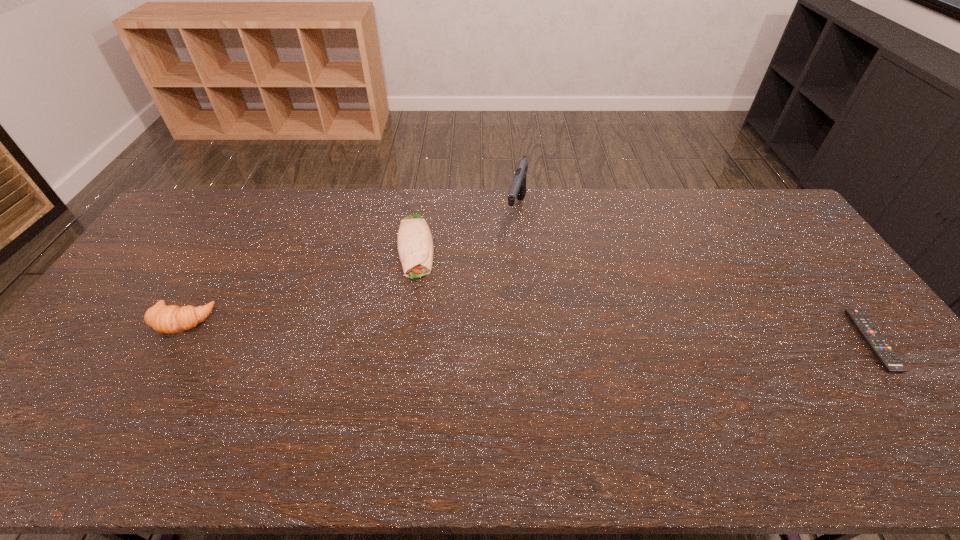
Where is `vacant area that lies between the tallest object and the crescent roll`? The image size is (960, 540). vacant area that lies between the tallest object and the crescent roll is located at coordinates (348, 266).

In order to click on vacant space that is in between the burrito and the gun in this screenshot , I will do (x=466, y=229).

You are a GUI agent. You are given a task and a screenshot of the screen. Output one action in this format:
    pyautogui.click(x=<x>, y=<y>)
    Task: Click on the blank region between the second object from left to right and the shortest object
    
    Given the screenshot: What is the action you would take?
    pyautogui.click(x=644, y=294)

The height and width of the screenshot is (540, 960). I want to click on free spot between the crescent roll and the third object from left to right, so click(x=348, y=266).

Where is `empty space that is in between the gun and the third shortest object`? empty space that is in between the gun and the third shortest object is located at coordinates (348, 266).

Identify which object is the second nearest to the gun. Please provide its 2D coordinates. Your answer should be formatted as a tuple, i.e. [(x, y)], where the tuple contains the x and y coordinates of a point satisfying the conditions above.

[(172, 319)]

Identify which object is the third closest to the tallest object. Please provide its 2D coordinates. Your answer should be formatted as a tuple, i.e. [(x, y)], where the tuple contains the x and y coordinates of a point satisfying the conditions above.

[(874, 339)]